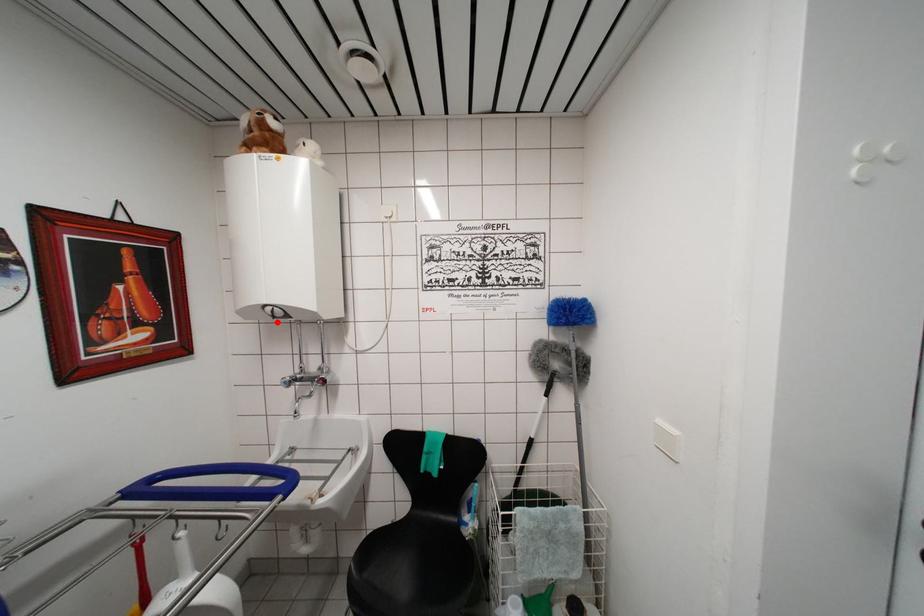
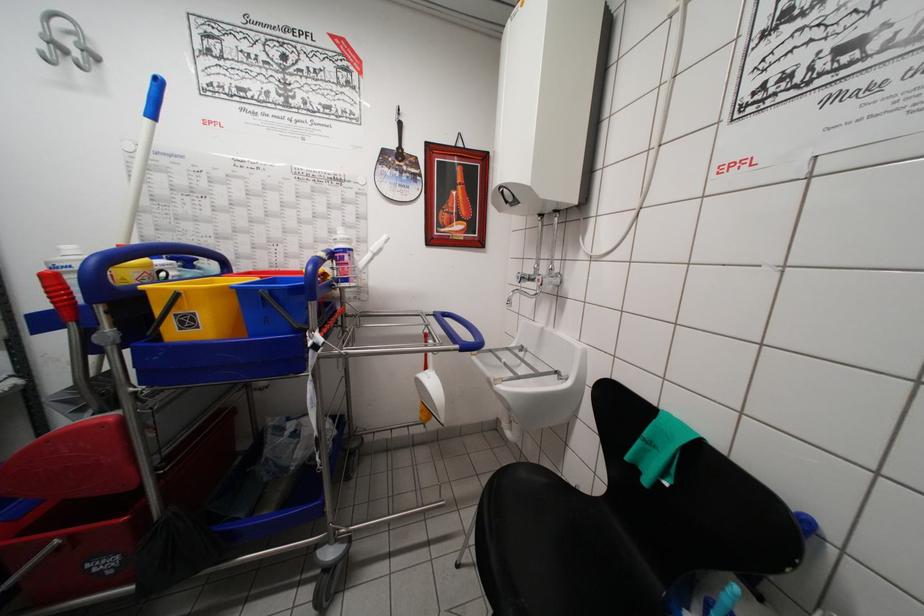
Find the pixel in the second image that matches the highlighted location in the first image.

(511, 207)